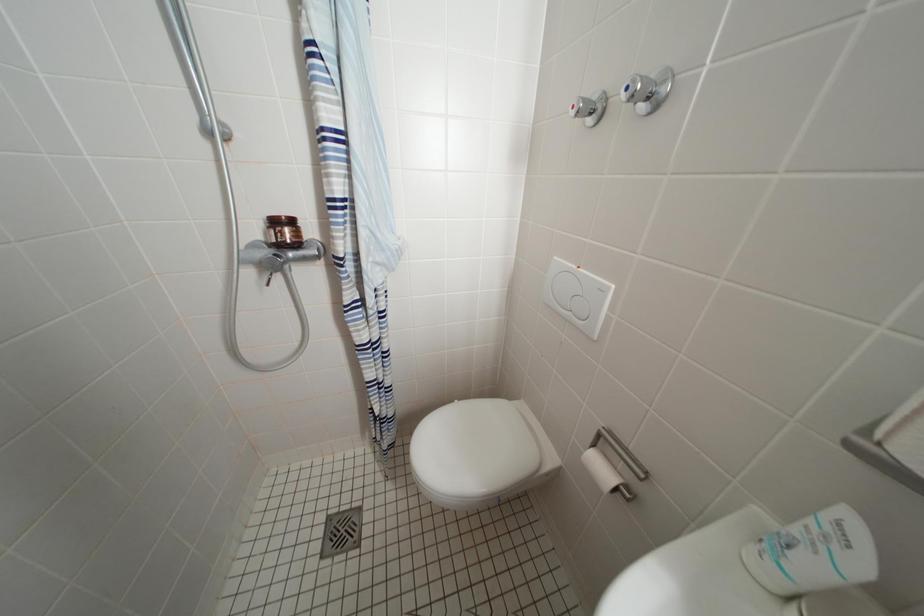
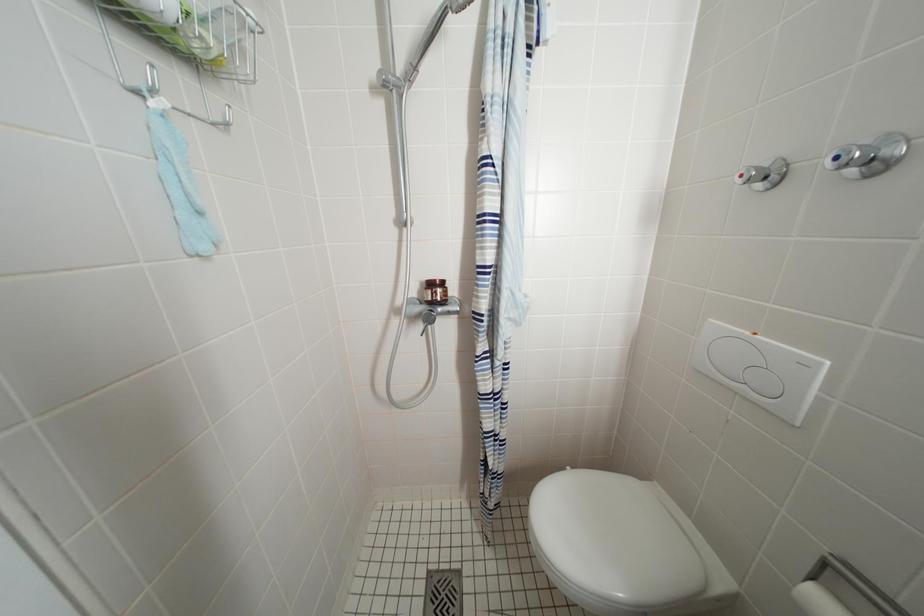
Question: The camera is either moving clockwise (left) or counter-clockwise (right) around the object. The first image is from the beginning of the video and the second image is from the end. Is the camera moving left or right when shooting the video?

Choices:
 (A) Left
 (B) Right

Answer: (B)